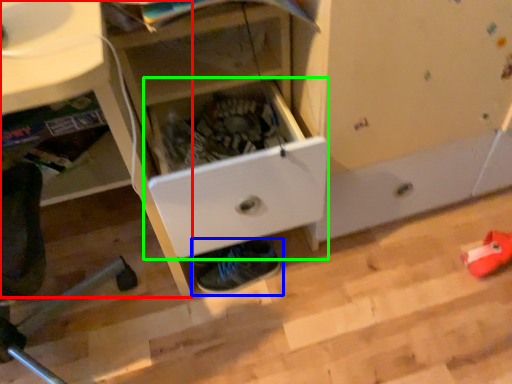
Question: Estimate the real-world distances between objects in this image. Which object is farther from computer desk (highlighted by a red box), footwear (highlighted by a blue box) or drawer (highlighted by a green box)?

Choices:
 (A) footwear
 (B) drawer

Answer: (A)